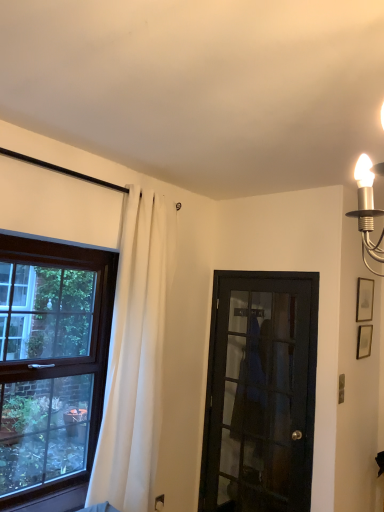
Question: Is brown wooden window at left shorter than black glass door at center?

Choices:
 (A) no
 (B) yes

Answer: (B)

Question: Does brown wooden window at left have a smaller size compared to black glass door at center?

Choices:
 (A) yes
 (B) no

Answer: (A)

Question: Is brown wooden window at left closer to camera compared to black glass door at center?

Choices:
 (A) yes
 (B) no

Answer: (A)

Question: Is brown wooden window at left to the right of black glass door at center from the viewer's perspective?

Choices:
 (A) no
 (B) yes

Answer: (A)

Question: Does brown wooden window at left have a greater height compared to black glass door at center?

Choices:
 (A) yes
 (B) no

Answer: (B)

Question: From a real-world perspective, is brown wooden window at left located higher than black glass door at center?

Choices:
 (A) yes
 (B) no

Answer: (A)

Question: Can you confirm if matte gold picture frame at upper right, marked as the first picture frame in a top-to-bottom arrangement, is shorter than white fabric curtain at left?

Choices:
 (A) no
 (B) yes

Answer: (B)

Question: Considering the relative sizes of matte gold picture frame at upper right, positioned as the 2th picture frame in bottom-to-top order, and white fabric curtain at left in the image provided, is matte gold picture frame at upper right, positioned as the 2th picture frame in bottom-to-top order, smaller than white fabric curtain at left?

Choices:
 (A) no
 (B) yes

Answer: (B)

Question: Is matte gold picture frame at upper right, marked as the first picture frame in a top-to-bottom arrangement, closer to camera compared to white fabric curtain at left?

Choices:
 (A) no
 (B) yes

Answer: (A)

Question: From a real-world perspective, is matte gold picture frame at upper right, marked as the first picture frame in a top-to-bottom arrangement, below white fabric curtain at left?

Choices:
 (A) yes
 (B) no

Answer: (B)

Question: Can you confirm if matte gold picture frame at upper right, marked as the first picture frame in a top-to-bottom arrangement, is wider than white fabric curtain at left?

Choices:
 (A) yes
 (B) no

Answer: (B)

Question: Are matte gold picture frame at upper right, positioned as the 2th picture frame in bottom-to-top order, and white fabric curtain at left far apart?

Choices:
 (A) no
 (B) yes

Answer: (B)

Question: Does white fabric curtain at left have a lesser height compared to matte gold picture frame at upper right, marked as the first picture frame in a top-to-bottom arrangement?

Choices:
 (A) yes
 (B) no

Answer: (B)